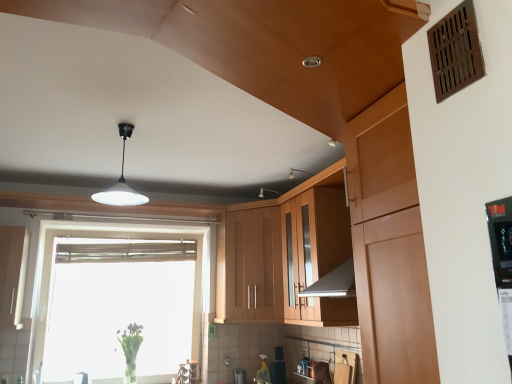
Question: Considering the relative sizes of wooden cabinet at center, placed as the first cabinetry when sorted from right to left, and translucent glass vase at lower left in the image provided, is wooden cabinet at center, placed as the first cabinetry when sorted from right to left, smaller than translucent glass vase at lower left?

Choices:
 (A) yes
 (B) no

Answer: (B)

Question: Does wooden cabinet at center, the 3th cabinetry viewed from the left, have a lesser height compared to translucent glass vase at lower left?

Choices:
 (A) yes
 (B) no

Answer: (B)

Question: From the image's perspective, is wooden cabinet at center, placed as the first cabinetry when sorted from right to left, on translucent glass vase at lower left?

Choices:
 (A) yes
 (B) no

Answer: (A)

Question: Is translucent glass vase at lower left at the back of wooden cabinet at center, the 3th cabinetry viewed from the left?

Choices:
 (A) no
 (B) yes

Answer: (A)

Question: Is translucent glass vase at lower left completely or partially inside wooden cabinet at center, placed as the first cabinetry when sorted from right to left?

Choices:
 (A) no
 (B) yes

Answer: (A)

Question: In the image, is transparent glass window at center on the left side or the right side of wooden cabinet at center, placed as the first cabinetry when sorted from right to left?

Choices:
 (A) left
 (B) right

Answer: (A)

Question: Is point (106, 322) closer or farther from the camera than point (330, 319)?

Choices:
 (A) closer
 (B) farther

Answer: (B)

Question: From the image's perspective, relative to wooden cabinet at center, placed as the first cabinetry when sorted from right to left, is transparent glass window at center above or below?

Choices:
 (A) above
 (B) below

Answer: (B)

Question: Based on their sizes in the image, would you say transparent glass window at center is bigger or smaller than wooden cabinet at center, the 3th cabinetry viewed from the left?

Choices:
 (A) small
 (B) big

Answer: (B)

Question: From the image's perspective, is translucent glass vase at lower left above or below transparent glass window at center?

Choices:
 (A) below
 (B) above

Answer: (A)

Question: Considering the positions of translucent glass vase at lower left and transparent glass window at center in the image, is translucent glass vase at lower left bigger or smaller than transparent glass window at center?

Choices:
 (A) big
 (B) small

Answer: (B)

Question: Visually, is translucent glass vase at lower left positioned to the left or to the right of transparent glass window at center?

Choices:
 (A) right
 (B) left

Answer: (A)

Question: Considering their positions, is translucent glass vase at lower left located in front of or behind transparent glass window at center?

Choices:
 (A) behind
 (B) front

Answer: (A)

Question: From a real-world perspective, relative to white glossy pendant light at center, is white glossy cabinet at left, which is counted as the 1th cabinetry, starting from the left, vertically above or below?

Choices:
 (A) below
 (B) above

Answer: (A)

Question: Considering the positions of point coord(1,286) and point coord(106,198), is point coord(1,286) closer or farther from the camera than point coord(106,198)?

Choices:
 (A) farther
 (B) closer

Answer: (A)